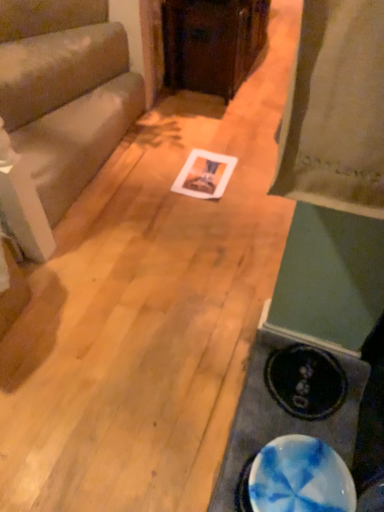
Question: From a real-world perspective, is wooden cabinet at center, which is the 1th furniture in right-to-left order, under blue marbled plate at lower right?

Choices:
 (A) no
 (B) yes

Answer: (A)

Question: Is wooden cabinet at center, the second furniture in the left-to-right sequence, wider than blue marbled plate at lower right?

Choices:
 (A) no
 (B) yes

Answer: (B)

Question: Is wooden cabinet at center, which is the 1th furniture in right-to-left order, looking in the opposite direction of blue marbled plate at lower right?

Choices:
 (A) no
 (B) yes

Answer: (A)

Question: Is the surface of wooden cabinet at center, the second furniture in the left-to-right sequence, in direct contact with blue marbled plate at lower right?

Choices:
 (A) yes
 (B) no

Answer: (B)

Question: From the image's perspective, is wooden cabinet at center, positioned as the 2th furniture in bottom-to-top order, above blue marbled plate at lower right?

Choices:
 (A) yes
 (B) no

Answer: (A)

Question: Is wooden cabinet at center, positioned as the 2th furniture in bottom-to-top order, thinner than blue marbled plate at lower right?

Choices:
 (A) yes
 (B) no

Answer: (B)

Question: Considering the relative sizes of wooden cabinet at center, the first furniture positioned from the top, and matte gray couch at left, which ranks as the second furniture in right-to-left order, in the image provided, is wooden cabinet at center, the first furniture positioned from the top, wider than matte gray couch at left, which ranks as the second furniture in right-to-left order,?

Choices:
 (A) no
 (B) yes

Answer: (B)

Question: Is wooden cabinet at center, positioned as the 2th furniture in bottom-to-top order, facing towards matte gray couch at left, acting as the first furniture starting from the left?

Choices:
 (A) yes
 (B) no

Answer: (B)

Question: Can you confirm if wooden cabinet at center, the first furniture positioned from the top, is taller than matte gray couch at left, which ranks as the second furniture in right-to-left order?

Choices:
 (A) yes
 (B) no

Answer: (A)

Question: From a real-world perspective, is wooden cabinet at center, the first furniture positioned from the top, located beneath matte gray couch at left, placed as the 2th furniture when sorted from top to bottom?

Choices:
 (A) no
 (B) yes

Answer: (A)

Question: Considering the relative sizes of wooden cabinet at center, positioned as the 2th furniture in bottom-to-top order, and matte gray couch at left, which ranks as the second furniture in right-to-left order, in the image provided, is wooden cabinet at center, positioned as the 2th furniture in bottom-to-top order, thinner than matte gray couch at left, which ranks as the second furniture in right-to-left order,?

Choices:
 (A) yes
 (B) no

Answer: (B)

Question: From the image's perspective, is wooden cabinet at center, the second furniture in the left-to-right sequence, located beneath matte gray couch at left, acting as the first furniture starting from the left?

Choices:
 (A) no
 (B) yes

Answer: (A)

Question: Is matte gray couch at left, acting as the first furniture starting from the left, looking in the opposite direction of blue marble table at lower right?

Choices:
 (A) yes
 (B) no

Answer: (B)